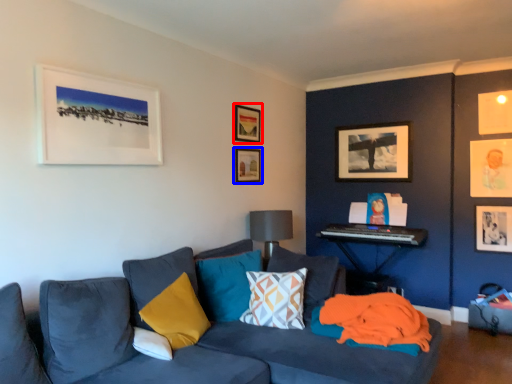
Question: Which object appears closest to the camera in this image, picture frame (highlighted by a red box) or picture frame (highlighted by a blue box)?

Choices:
 (A) picture frame
 (B) picture frame

Answer: (A)